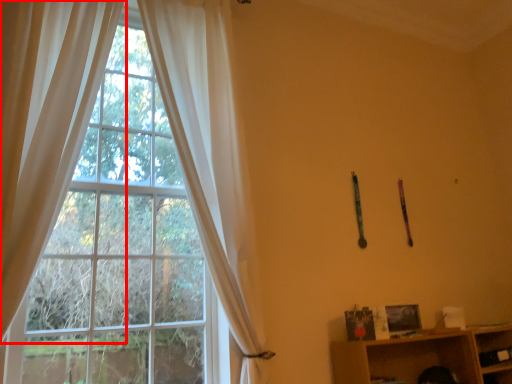
Question: In this image, where is curtain (annotated by the red box) located relative to curtain?

Choices:
 (A) left
 (B) right

Answer: (A)